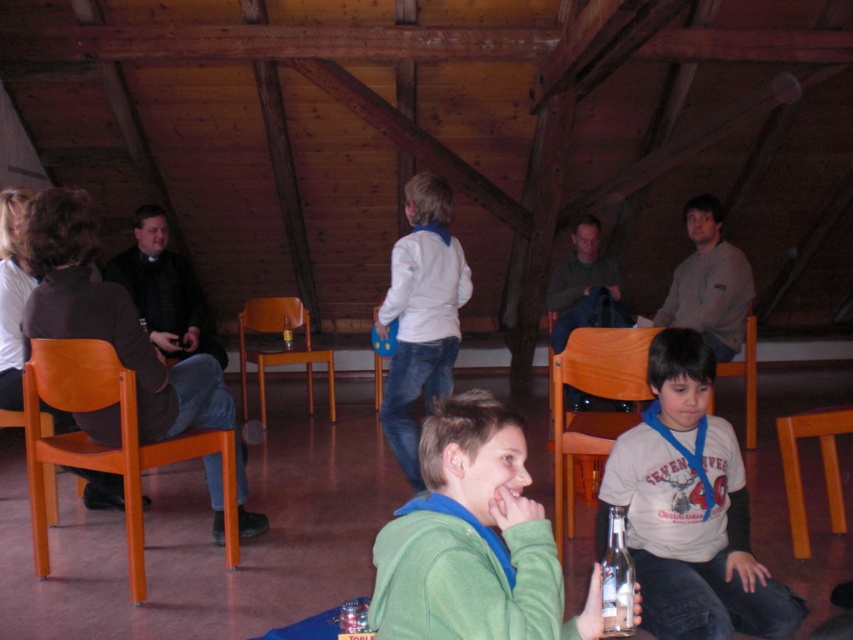
In the scene shown: Is white matte jacket at center thinner than orange wood chair at lower right?

Incorrect, white matte jacket at center's width is not less than orange wood chair at lower right's.

Can you confirm if white matte jacket at center is bigger than orange wood chair at lower right?

Yes.

Locate an element on the screen. white matte jacket at center is located at coordinates [421, 316].

Does white cotton shirt at center appear under orange wood chair at center?

Yes.

What do you see at coordinates (689, 508) in the screenshot?
I see `white cotton shirt at center` at bounding box center [689, 508].

You are a GUI agent. You are given a task and a screenshot of the screen. Output one action in this format:
    pyautogui.click(x=<x>, y=<y>)
    Task: Click on the white cotton shirt at center
    The width and height of the screenshot is (853, 640).
    Given the screenshot: What is the action you would take?
    pyautogui.click(x=689, y=508)

At what (x,y) coordinates should I click in order to perform the action: click on white cotton shirt at center. Please return your answer as a coordinate pair (x, y). Looking at the image, I should click on (689, 508).

Between white cotton shirt at center and clear glass bottle at lower center, which one is positioned lower?

clear glass bottle at lower center is below.

Who is positioned more to the right, white cotton shirt at center or clear glass bottle at lower center?

Positioned to the right is white cotton shirt at center.

Does point (729, 436) lie in front of point (625, 632)?

No, it is not.

The height and width of the screenshot is (640, 853). I want to click on white cotton shirt at center, so click(689, 508).